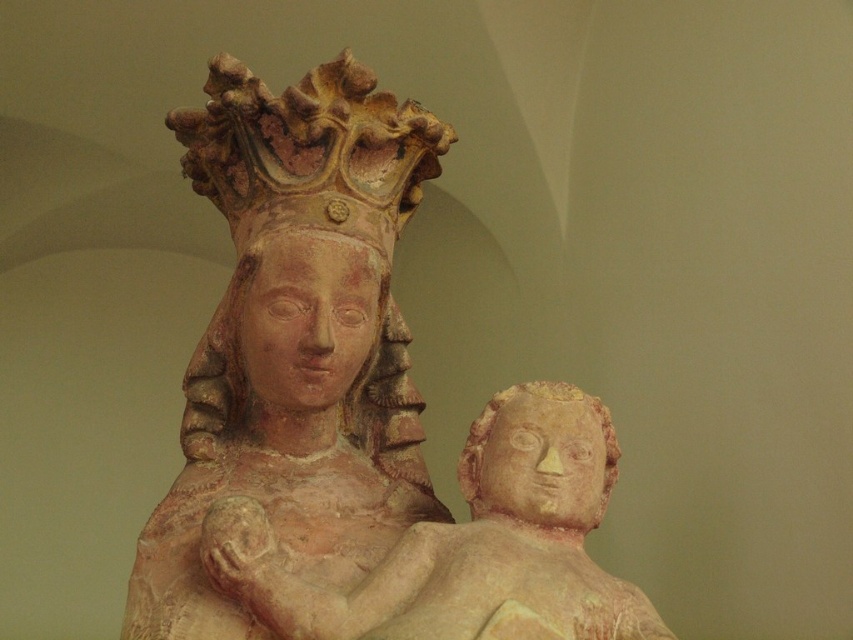
Question: Does matte terracotta baby at lower center appear on the left side of matte stone head at center?

Choices:
 (A) yes
 (B) no

Answer: (A)

Question: Does matte terracotta statue at center appear on the left side of matte terracotta baby at lower center?

Choices:
 (A) no
 (B) yes

Answer: (B)

Question: Which point is closer to the camera taking this photo?

Choices:
 (A) (585, 396)
 (B) (401, 128)
 (C) (364, 328)

Answer: (A)

Question: In this image, where is matte terracotta baby at lower center located relative to matte stone head at center?

Choices:
 (A) above
 (B) below

Answer: (B)

Question: Among these points, which one is nearest to the camera?

Choices:
 (A) (297, 230)
 (B) (577, 568)

Answer: (B)

Question: Based on their relative distances, which object is nearer to the matte stone head at center?

Choices:
 (A) matte terracotta baby at lower center
 (B) matte terracotta head at center

Answer: (A)